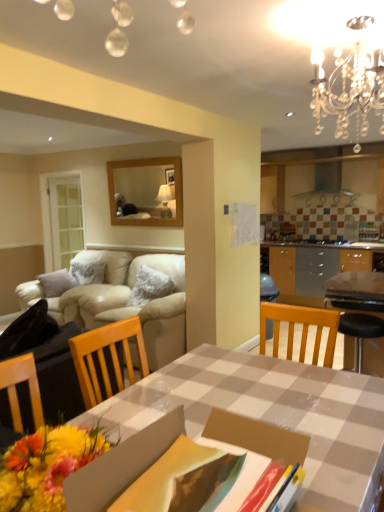
The height and width of the screenshot is (512, 384). What do you see at coordinates (349, 90) in the screenshot?
I see `crystal chandelier at upper right` at bounding box center [349, 90].

Measure the distance between checkerboard plastic table at center and camera.

The depth of checkerboard plastic table at center is 9.24 feet.

In order to face checkered fabric table at center, should I rotate leftwards or rightwards?

To face it directly, rotate right by 6.637 degrees.

Image resolution: width=384 pixels, height=512 pixels. Identify the location of beige leather couch at left. (131, 307).

Are checkered fabric table at center and beige leather couch at left beside each other?

checkered fabric table at center is not next to beige leather couch at left, and they're not touching.

Is point (330, 465) positioned behind point (130, 316)?

That is False.

From the image's perspective, does checkered fabric table at center appear higher than beige leather couch at left?

No, from the image's perspective, checkered fabric table at center is not on top of beige leather couch at left.

Between crystal chandelier at upper right and checkered fabric table at center, which one is positioned in front?

Positioned in front is checkered fabric table at center.

From the image's perspective, is crystal chandelier at upper right positioned above or below checkered fabric table at center?

crystal chandelier at upper right is situated higher than checkered fabric table at center in the image.

From a real-world perspective, is crystal chandelier at upper right on top of checkered fabric table at center?

Indeed, from a real-world perspective, crystal chandelier at upper right stands above checkered fabric table at center.

What's the angular difference between crystal chandelier at upper right and checkerboard plastic table at center's facing directions?

0.000428 degrees separate the facing orientations of crystal chandelier at upper right and checkerboard plastic table at center.

From the image's perspective, is crystal chandelier at upper right on top of checkerboard plastic table at center?

Yes, from the image's perspective, crystal chandelier at upper right is over checkerboard plastic table at center.

Is crystal chandelier at upper right at the right side of checkerboard plastic table at center?

In fact, crystal chandelier at upper right is to the left of checkerboard plastic table at center.

Does crystal chandelier at upper right have a lesser width compared to checkerboard plastic table at center?

Indeed, crystal chandelier at upper right has a lesser width compared to checkerboard plastic table at center.

Is beige leather couch at left facing towards crystal chandelier at upper right?

No.

Which is more to the left, beige leather couch at left or crystal chandelier at upper right?

From the viewer's perspective, beige leather couch at left appears more on the left side.

From a real-world perspective, relative to crystal chandelier at upper right, is beige leather couch at left vertically above or below?

beige leather couch at left is situated lower than crystal chandelier at upper right in the real world.

Consider the image. Can you confirm if beige leather couch at left is taller than crystal chandelier at upper right?

Correct, beige leather couch at left is much taller as crystal chandelier at upper right.

Would you say beige leather couch at left is a long distance from checkerboard plastic table at center?

Yes, beige leather couch at left and checkerboard plastic table at center are quite far apart.

Would you say checkerboard plastic table at center is part of beige leather couch at left's contents?

That's incorrect, checkerboard plastic table at center is not inside beige leather couch at left.

From the image's perspective, which is below, beige leather couch at left or checkerboard plastic table at center?

checkerboard plastic table at center is shown below in the image.

At what (x,y) coordinates should I click in order to perform the action: click on studio couch lying behind the checkerboard plastic table at center. Please return your answer as a coordinate pair (x, y). Looking at the image, I should click on (131, 307).

Measure the distance from beige leather couch at left to checkered fabric table at center.

beige leather couch at left and checkered fabric table at center are 1.95 meters apart from each other.

Based on the photo, is beige leather couch at left oriented away from checkered fabric table at center?

No, checkered fabric table at center is not at the back of beige leather couch at left.

Which is more to the left, beige leather couch at left or checkered fabric table at center?

From the viewer's perspective, beige leather couch at left appears more on the left side.

Considering the positions of objects checkerboard plastic table at center and checkered fabric table at center in the image provided, who is in front, checkerboard plastic table at center or checkered fabric table at center?

checkered fabric table at center.

Is checkerboard plastic table at center next to checkered fabric table at center?

No, checkerboard plastic table at center is not touching checkered fabric table at center.

In terms of height, does checkerboard plastic table at center look taller or shorter compared to checkered fabric table at center?

checkerboard plastic table at center is taller than checkered fabric table at center.

Can you tell me how much checkerboard plastic table at center and checkered fabric table at center differ in facing direction?

The facing directions of checkerboard plastic table at center and checkered fabric table at center are 91.3 degrees apart.

Find the location of a particular element. The height and width of the screenshot is (512, 384). studio couch above the checkered fabric table at center (from a real-world perspective) is located at coordinates (131, 307).

This screenshot has height=512, width=384. Identify the location of desk below the crystal chandelier at upper right (from the image's perspective). (270, 412).

Based on their spatial positions, is checkerboard plastic table at center or beige leather couch at left closer to crystal chandelier at upper right?

checkerboard plastic table at center lies closer to crystal chandelier at upper right than the other object.

From the image, which object appears to be farther from checkered fabric table at center, crystal chandelier at upper right or beige leather couch at left?

beige leather couch at left is positioned further to the anchor checkered fabric table at center.

When comparing their distances from checkered fabric table at center, does checkerboard plastic table at center or crystal chandelier at upper right seem further?

checkerboard plastic table at center.

When comparing their distances from beige leather couch at left, does checkered fabric table at center or checkerboard plastic table at center seem further?

The object further to beige leather couch at left is checkered fabric table at center.

Based on their spatial positions, is beige leather couch at left or checkerboard plastic table at center further from crystal chandelier at upper right?

The object further to crystal chandelier at upper right is beige leather couch at left.

Based on their spatial positions, is checkerboard plastic table at center or beige leather couch at left further from checkered fabric table at center?

The object further to checkered fabric table at center is beige leather couch at left.

Based on the photo, when comparing their distances from checkered fabric table at center, does crystal chandelier at upper right or checkerboard plastic table at center seem further?

Among the two, checkerboard plastic table at center is located further to checkered fabric table at center.

Based on the photo, looking at the image, which one is located further to crystal chandelier at upper right, checkerboard plastic table at center or checkered fabric table at center?

checkerboard plastic table at center is positioned further to the anchor crystal chandelier at upper right.

Where is `table between crystal chandelier at upper right and checkered fabric table at center in the up-down direction`? table between crystal chandelier at upper right and checkered fabric table at center in the up-down direction is located at coordinates (356, 291).

This screenshot has height=512, width=384. What are the coordinates of `table located between checkered fabric table at center and beige leather couch at left in the depth direction` in the screenshot? It's located at (356, 291).

Identify the location of table between crystal chandelier at upper right and beige leather couch at left from front to back. (356, 291).

Image resolution: width=384 pixels, height=512 pixels. Identify the location of light fixture positioned between checkered fabric table at center and beige leather couch at left from near to far. (349, 90).